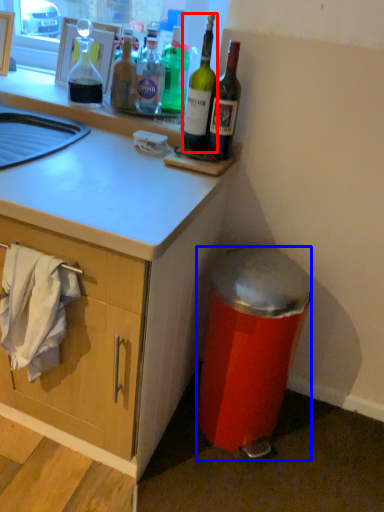
Question: Which object appears closest to the camera in this image, bottle (highlighted by a red box) or trash bin/can (highlighted by a blue box)?

Choices:
 (A) bottle
 (B) trash bin/can

Answer: (B)